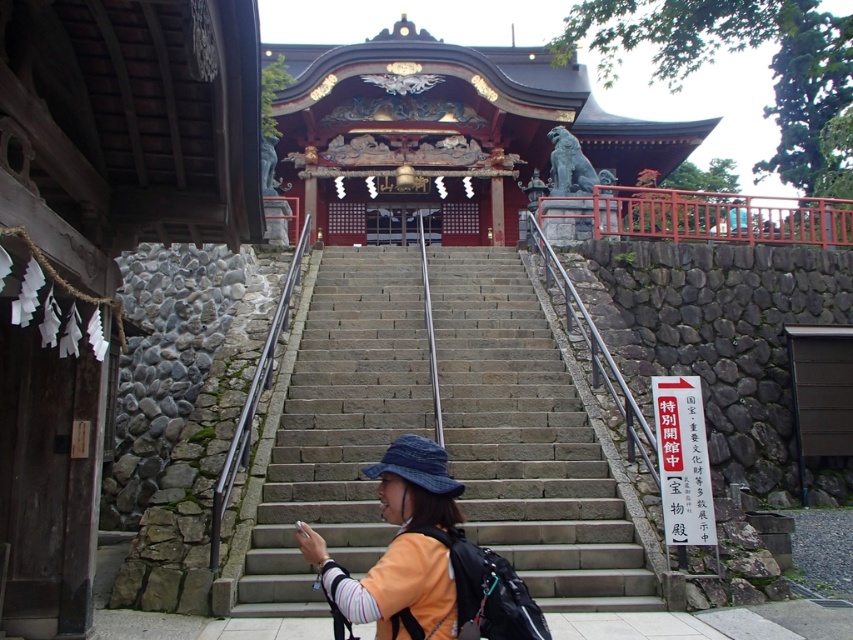
You are a visitor at the shrine and want to place your orange fabric jacket at center on the gray stone stairs at center. Will the jacket fit entirely on the stairs?

The gray stone stairs at center is larger in size than orange fabric jacket at center, so the jacket will fit entirely on the stairs.